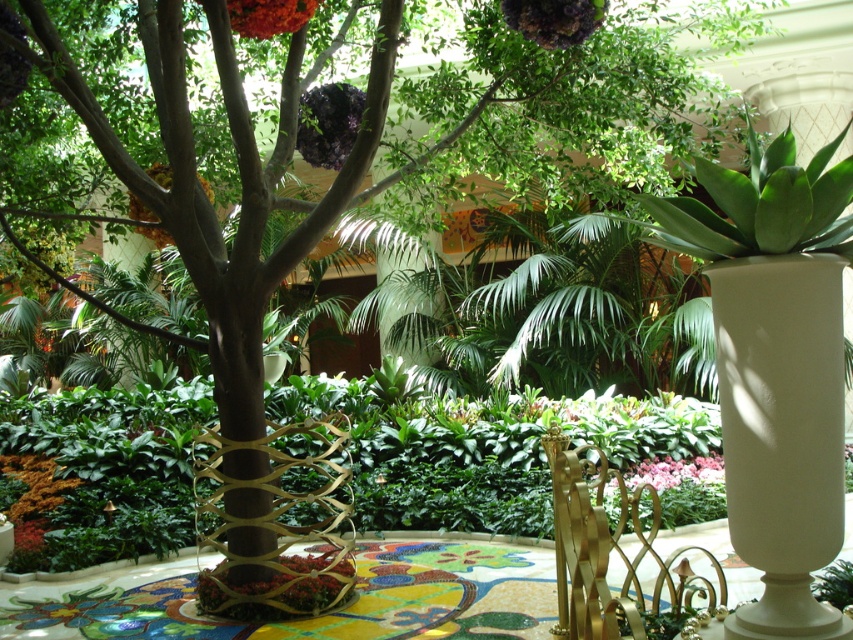
Which is more to the left, red velvet flower at center or shiny orange flower at upper center?

Positioned to the left is red velvet flower at center.

Looking at this image, does red velvet flower at center appear over shiny orange flower at upper center?

No, red velvet flower at center is not above shiny orange flower at upper center.

At what (x,y) coordinates should I click in order to perform the action: click on red velvet flower at center. Please return your answer as a coordinate pair (x, y). Looking at the image, I should click on (277, 588).

The height and width of the screenshot is (640, 853). Describe the element at coordinates (782, 433) in the screenshot. I see `white glossy vase at right` at that location.

Consider the image. Who is more forward, (775,365) or (682,467)?

Positioned in front is point (775,365).

You are a GUI agent. You are given a task and a screenshot of the screen. Output one action in this format:
    pyautogui.click(x=<x>, y=<y>)
    Task: Click on the white glossy vase at right
    
    Given the screenshot: What is the action you would take?
    pyautogui.click(x=782, y=433)

Can you confirm if shiny purple flower at upper center is wider than orange fuzzy flower at lower left?

No, shiny purple flower at upper center is not wider than orange fuzzy flower at lower left.

Is the position of shiny purple flower at upper center less distant than that of orange fuzzy flower at lower left?

That is True.

Find the location of a particular element. This screenshot has width=853, height=640. shiny purple flower at upper center is located at coordinates tap(329, 124).

Find the location of `shiny purple flower at upper center`. shiny purple flower at upper center is located at coordinates (329, 124).